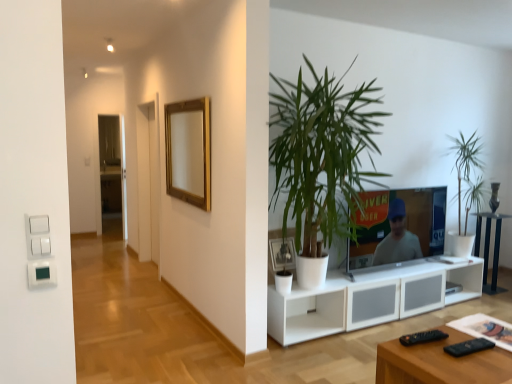
Question: Which direction should I rotate to look at white matte picture frame at center, which is the second picture frame from left to right, — up or down?

Choices:
 (A) up
 (B) down

Answer: (B)

Question: Is gold wooden picture frame at upper center, acting as the first picture frame starting from the top, bigger than green leafy plant at center, the 1th houseplant from the left?

Choices:
 (A) yes
 (B) no

Answer: (B)

Question: Considering the relative positions of gold wooden picture frame at upper center, which is counted as the first picture frame, starting from the left, and green leafy plant at center, the 1th houseplant from the left, in the image provided, is gold wooden picture frame at upper center, which is counted as the first picture frame, starting from the left, to the left of green leafy plant at center, the 1th houseplant from the left, from the viewer's perspective?

Choices:
 (A) yes
 (B) no

Answer: (A)

Question: Can you confirm if gold wooden picture frame at upper center, which is counted as the first picture frame, starting from the left, is smaller than green leafy plant at center, which is counted as the 2th houseplant, starting from the back?

Choices:
 (A) yes
 (B) no

Answer: (A)

Question: Could you tell me if gold wooden picture frame at upper center, acting as the first picture frame starting from the top, is facing green leafy plant at center, the 1th houseplant from the left?

Choices:
 (A) yes
 (B) no

Answer: (B)

Question: From the image's perspective, is gold wooden picture frame at upper center, which is counted as the first picture frame, starting from the left, located above green leafy plant at center, which is counted as the 2th houseplant, starting from the back?

Choices:
 (A) no
 (B) yes

Answer: (B)

Question: Is gold wooden picture frame at upper center, which is counted as the first picture frame, starting from the left, behind green leafy plant at center, the 1th houseplant from the left?

Choices:
 (A) no
 (B) yes

Answer: (B)

Question: Is white ceramic vase at center closer to the viewer compared to white matte picture frame at center, which is the second picture frame from left to right?

Choices:
 (A) yes
 (B) no

Answer: (B)

Question: Is white ceramic vase at center turned away from white matte picture frame at center, the second picture frame when ordered from top to bottom?

Choices:
 (A) yes
 (B) no

Answer: (B)

Question: Considering the relative sizes of white ceramic vase at center and white matte picture frame at center, acting as the 1th picture frame starting from the right, in the image provided, is white ceramic vase at center thinner than white matte picture frame at center, acting as the 1th picture frame starting from the right,?

Choices:
 (A) yes
 (B) no

Answer: (A)

Question: From the image's perspective, is white ceramic vase at center below white matte picture frame at center, marked as the first picture frame in a front-to-back arrangement?

Choices:
 (A) no
 (B) yes

Answer: (A)

Question: Can you confirm if white ceramic vase at center is taller than white matte picture frame at center, which is the second picture frame from left to right?

Choices:
 (A) no
 (B) yes

Answer: (A)

Question: Can you confirm if white ceramic vase at center is shorter than white matte picture frame at center, which is the 1th picture frame in bottom-to-top order?

Choices:
 (A) no
 (B) yes

Answer: (B)

Question: Considering the relative sizes of green leafy plant at right, which appears as the 1th houseplant when viewed from the back, and black glass side table at lower right in the image provided, is green leafy plant at right, which appears as the 1th houseplant when viewed from the back, thinner than black glass side table at lower right?

Choices:
 (A) no
 (B) yes

Answer: (A)